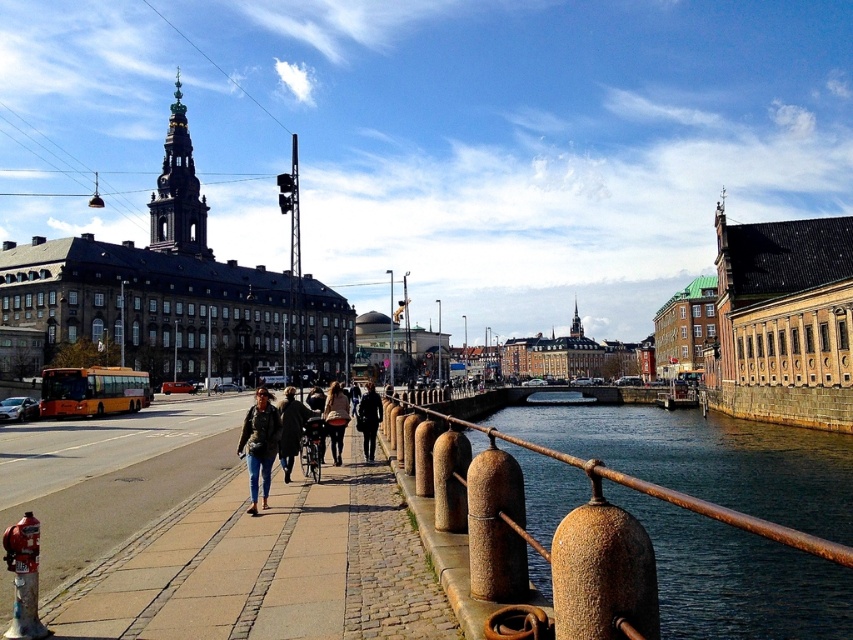
Does dark brown leather jacket at center have a lesser width compared to leather jacket at center?

Incorrect, dark brown leather jacket at center's width is not less than leather jacket at center's.

Which is more to the left, dark brown leather jacket at center or leather jacket at center?

dark brown leather jacket at center

Who is more forward, (293, 406) or (339, 448)?

Point (293, 406) is more forward.

The image size is (853, 640). I want to click on dark brown leather jacket at center, so click(x=289, y=429).

Which is more to the left, cobblestone sidewalk at center or dark brown leather jacket at center?

dark brown leather jacket at center is more to the left.

Is point (289, 588) farther from viewer compared to point (292, 412)?

No, it is in front of (292, 412).

Image resolution: width=853 pixels, height=640 pixels. I want to click on cobblestone sidewalk at center, so click(265, 566).

Is red metallic fire hydrant at lower left bigger than denim jacket at center?

Actually, red metallic fire hydrant at lower left might be smaller than denim jacket at center.

Is point (20, 600) positioned after point (253, 499)?

That is False.

You are a GUI agent. You are given a task and a screenshot of the screen. Output one action in this format:
    pyautogui.click(x=<x>, y=<y>)
    Task: Click on the red metallic fire hydrant at lower left
    
    Given the screenshot: What is the action you would take?
    point(24,577)